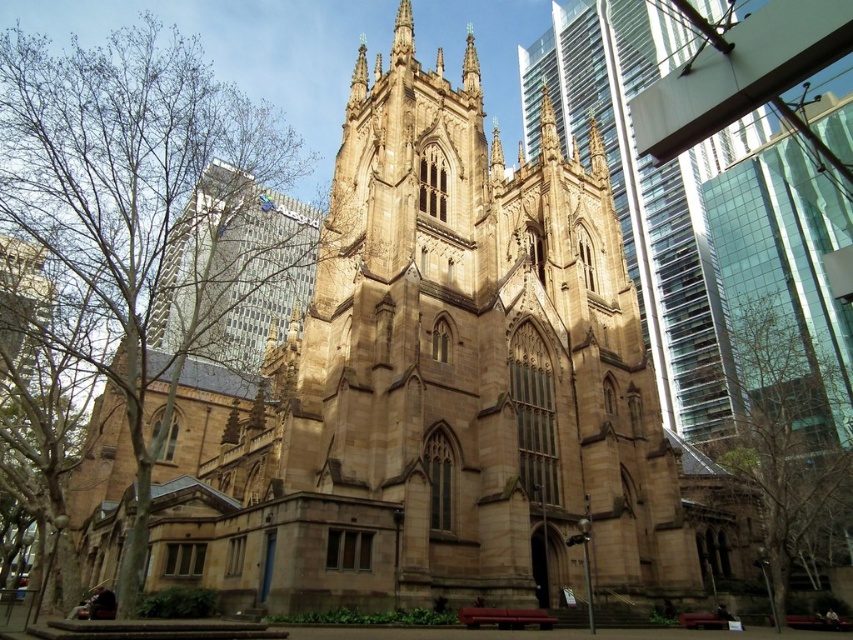
Question: Which point appears farthest from the camera in this image?

Choices:
 (A) (100, 285)
 (B) (753, 339)

Answer: (B)

Question: Does brown leafless tree at left have a greater width compared to brown textured tree at lower right?

Choices:
 (A) no
 (B) yes

Answer: (B)

Question: Which point is closer to the camera taking this photo?

Choices:
 (A) (138, 288)
 (B) (820, 394)

Answer: (A)

Question: Can you confirm if brown leafless tree at left is positioned above brown textured tree at lower right?

Choices:
 (A) yes
 (B) no

Answer: (A)

Question: Can you confirm if brown leafless tree at left is wider than brown textured tree at lower right?

Choices:
 (A) yes
 (B) no

Answer: (A)